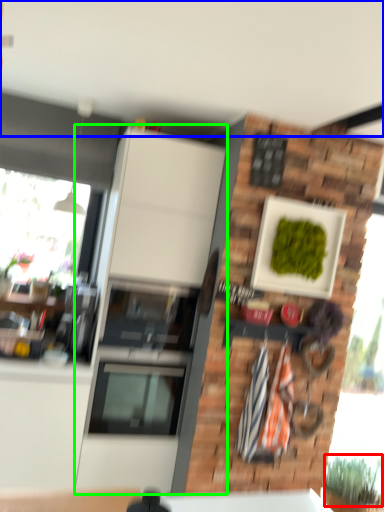
Question: Considering the real-world distances, which object is farthest from plant (highlighted by a red box)? backdrop (highlighted by a blue box) or cabinetry (highlighted by a green box)?

Choices:
 (A) backdrop
 (B) cabinetry

Answer: (A)